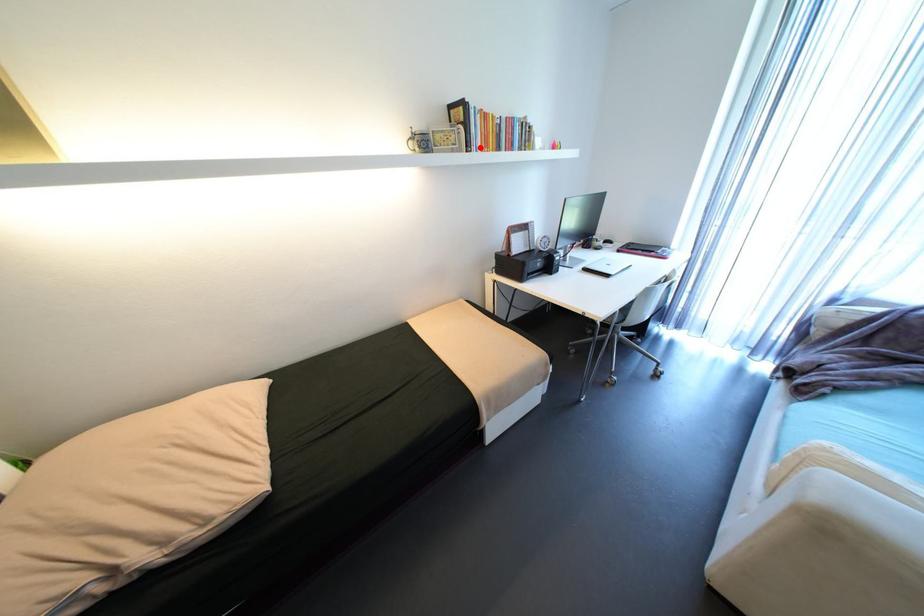
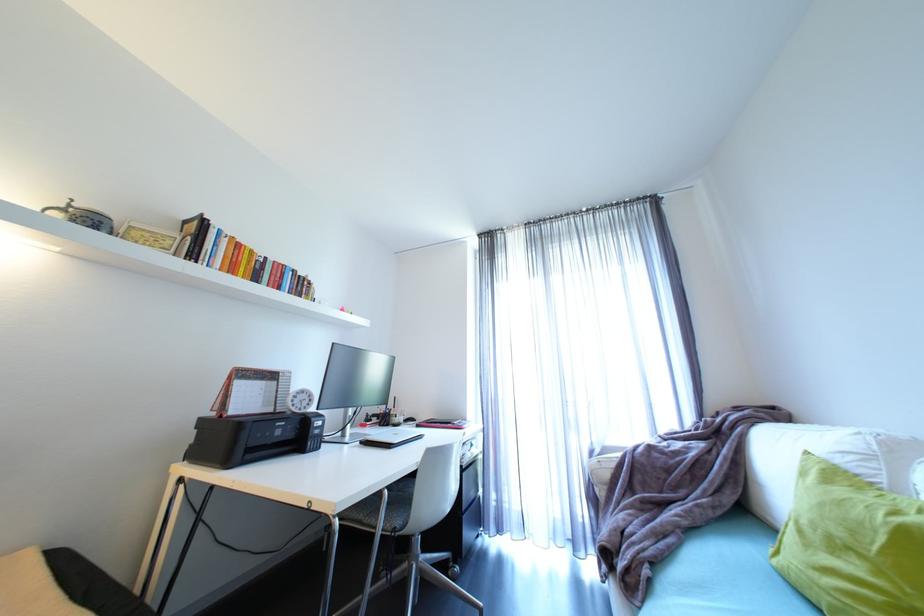
Locate, in the second image, the point that corresponds to the highlighted location in the first image.

(208, 262)